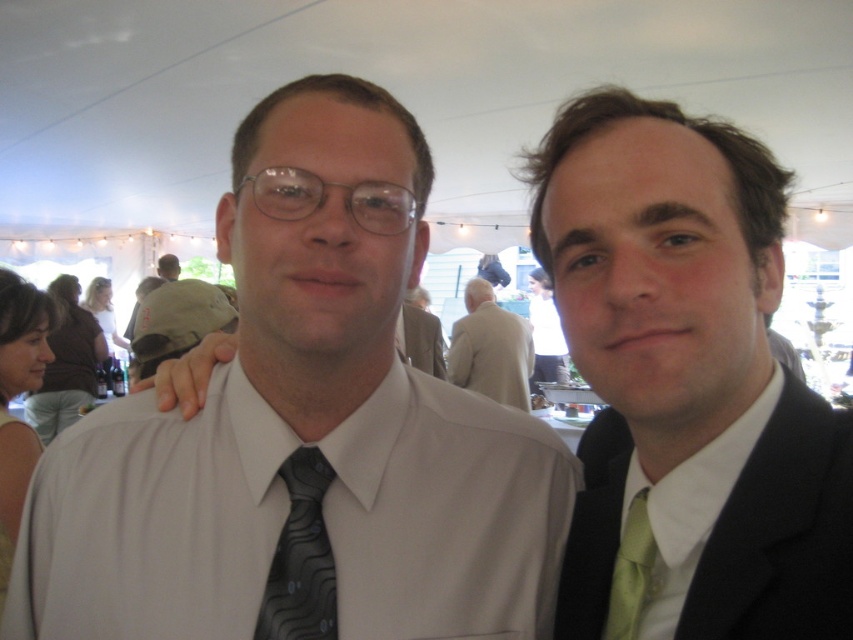
Is point (805, 522) more distant than point (633, 544)?

No, it is in front of (633, 544).

Which is below, black matte suit at right or green silk tie at right?

green silk tie at right is below.

Which is in front, point (788, 502) or point (621, 547)?

Point (788, 502) is more forward.

Image resolution: width=853 pixels, height=640 pixels. Identify the location of black matte suit at right. (782, 534).

Where is `black textured tie at center`? black textured tie at center is located at coordinates (300, 557).

Identify the location of black textured tie at center. (300, 557).

Can you confirm if green silk tie at center is thinner than white satin dress shirt at center?

Indeed, green silk tie at center has a lesser width compared to white satin dress shirt at center.

Does point (691, 438) come behind point (546, 612)?

No, it is in front of (546, 612).

Locate an element on the screen. Image resolution: width=853 pixels, height=640 pixels. green silk tie at center is located at coordinates (689, 376).